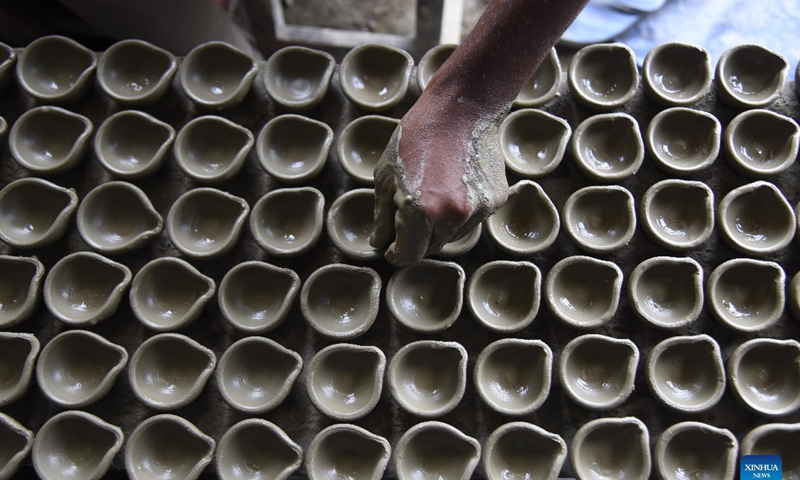
This screenshot has height=480, width=800. In order to click on cup in this screenshot , I will do `click(604, 310)`.